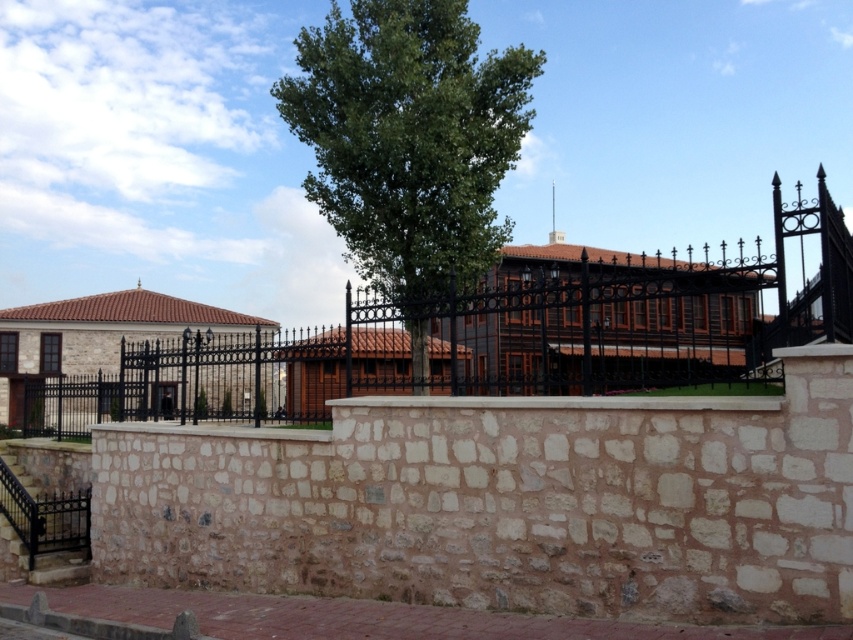
Question: Can you confirm if black wrought iron fence at center is positioned to the right of green leafy tree at center?

Choices:
 (A) yes
 (B) no

Answer: (A)

Question: Which of the following is the farthest from the observer?

Choices:
 (A) black wrought iron fence at center
 (B) green leafy tree at center

Answer: (B)

Question: Among these points, which one is farthest from the camera?

Choices:
 (A) (477, 369)
 (B) (361, 214)

Answer: (A)

Question: Is black wrought iron fence at center smaller than green leafy tree at center?

Choices:
 (A) yes
 (B) no

Answer: (A)

Question: Is black wrought iron fence at center above green leafy tree at center?

Choices:
 (A) no
 (B) yes

Answer: (A)